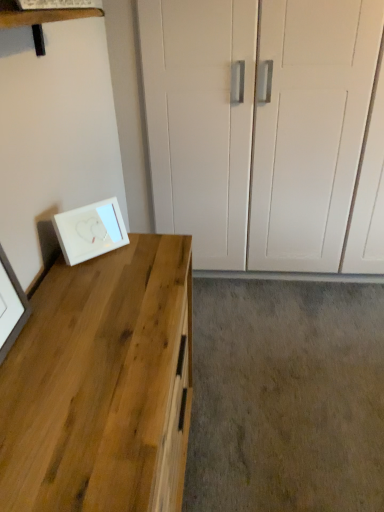
Question: From a real-world perspective, is natural wood desk at left physically located above or below white glossy picture frame at lower left?

Choices:
 (A) above
 (B) below

Answer: (B)

Question: Looking at their shapes, would you say natural wood desk at left is wider or thinner than white glossy picture frame at lower left?

Choices:
 (A) thin
 (B) wide

Answer: (B)

Question: In the image, is natural wood desk at left positioned in front of or behind white glossy picture frame at lower left?

Choices:
 (A) behind
 (B) front

Answer: (B)

Question: Is white glossy picture frame at lower left wider or thinner than natural wood desk at left?

Choices:
 (A) thin
 (B) wide

Answer: (A)

Question: From the image's perspective, is white glossy picture frame at lower left positioned above or below natural wood desk at left?

Choices:
 (A) below
 (B) above

Answer: (B)

Question: Is white glossy picture frame at lower left situated inside natural wood desk at left or outside?

Choices:
 (A) inside
 (B) outside

Answer: (B)

Question: In the image, is white glossy picture frame at lower left positioned in front of or behind natural wood desk at left?

Choices:
 (A) front
 (B) behind

Answer: (B)